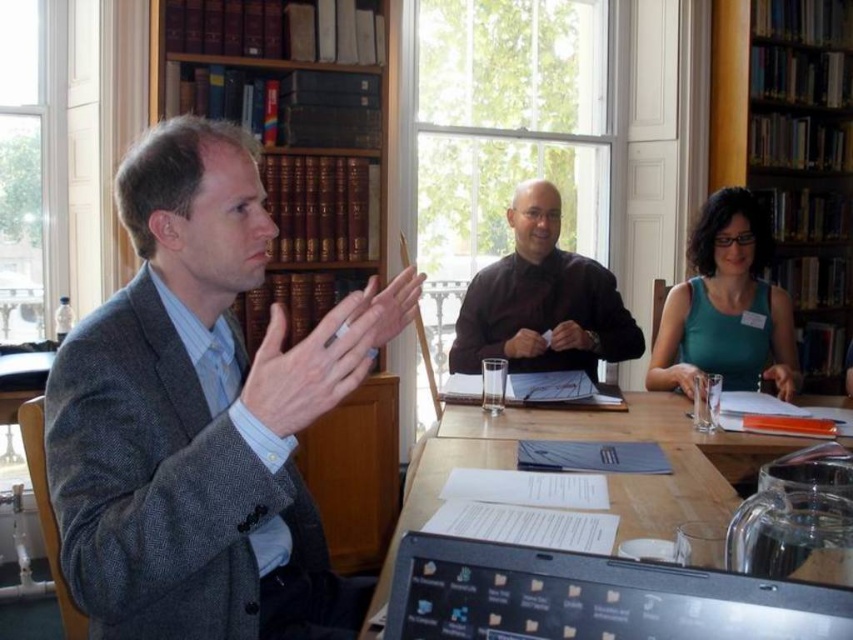
You are organizing a workshop in this library and need to place a 25 cm wide presentation binder on the wooden table at center. Can the black glossy laptop at lower center be moved to make space for the binder without overlapping?

The black glossy laptop at lower center has a width less than the wooden table at center, so moving it aside should provide enough space for the 25 cm wide binder.

You are a photographer standing in front of the table in the library scene. You want to take a photo of both point (733,74) and point (439,566) on the table. Which point is closer to your camera?

Point (439,566) is closer to the camera because it is less further than point (733,74).